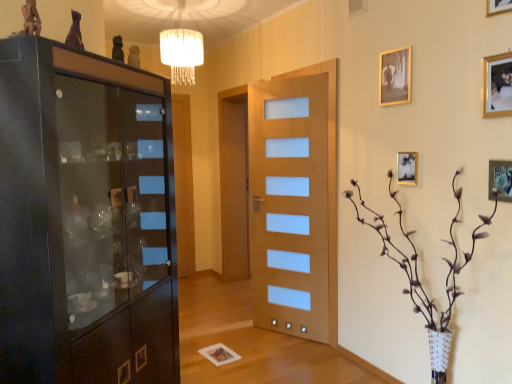
Question: Considering the relative sizes of metallic gold picture frame at upper right, which appears as the fifth picture frame when viewed from the top, and gold metallic picture frame at upper right, which appears as the 4th picture frame when viewed from the top, in the image provided, is metallic gold picture frame at upper right, which appears as the fifth picture frame when viewed from the top, shorter than gold metallic picture frame at upper right, which appears as the 4th picture frame when viewed from the top,?

Choices:
 (A) no
 (B) yes

Answer: (A)

Question: Can you confirm if metallic gold picture frame at upper right, which appears as the fifth picture frame when viewed from the top, is smaller than gold metallic picture frame at upper right, which appears as the 4th picture frame when viewed from the top?

Choices:
 (A) yes
 (B) no

Answer: (B)

Question: Is metallic gold picture frame at upper right, which appears as the fifth picture frame when viewed from the top, facing away from gold metallic picture frame at upper right, the 2th picture frame from the bottom?

Choices:
 (A) yes
 (B) no

Answer: (B)

Question: Is metallic gold picture frame at upper right, which appears as the fifth picture frame when viewed from the top, oriented towards gold metallic picture frame at upper right, which appears as the 4th picture frame when viewed from the top?

Choices:
 (A) no
 (B) yes

Answer: (A)

Question: Is metallic gold picture frame at upper right, which ranks as the first picture frame in bottom-to-top order, in front of gold metallic picture frame at upper right, which appears as the 4th picture frame when viewed from the top?

Choices:
 (A) yes
 (B) no

Answer: (A)

Question: Can you confirm if metallic gold picture frame at upper right, which ranks as the first picture frame in bottom-to-top order, is taller than gold metallic picture frame at upper right, the 2th picture frame from the bottom?

Choices:
 (A) no
 (B) yes

Answer: (B)

Question: From the image's perspective, is matte gold picture frame at upper right, which is counted as the second picture frame, starting from the top, above gold metallic picture frame at upper right, which is counted as the first picture frame, starting from the top?

Choices:
 (A) no
 (B) yes

Answer: (A)

Question: Can you confirm if matte gold picture frame at upper right, which is counted as the second picture frame, starting from the top, is positioned to the left of gold metallic picture frame at upper right, the 5th picture frame in the bottom-to-top sequence?

Choices:
 (A) yes
 (B) no

Answer: (A)

Question: Could you tell me if matte gold picture frame at upper right, which is counted as the second picture frame, starting from the top, is facing gold metallic picture frame at upper right, the 5th picture frame in the bottom-to-top sequence?

Choices:
 (A) yes
 (B) no

Answer: (B)

Question: Does matte gold picture frame at upper right, which is counted as the second picture frame, starting from the top, come behind gold metallic picture frame at upper right, the 5th picture frame in the bottom-to-top sequence?

Choices:
 (A) yes
 (B) no

Answer: (A)

Question: Is matte gold picture frame at upper right, which appears as the 4th picture frame when ordered from the bottom, positioned with its back to gold metallic picture frame at upper right, the 5th picture frame in the bottom-to-top sequence?

Choices:
 (A) no
 (B) yes

Answer: (A)

Question: From a real-world perspective, is matte gold picture frame at upper right, which is counted as the second picture frame, starting from the top, physically above gold metallic picture frame at upper right, the 5th picture frame in the bottom-to-top sequence?

Choices:
 (A) no
 (B) yes

Answer: (A)

Question: Could matte gold picture frame at upper right, which appears as the 4th picture frame when ordered from the bottom, be considered to be inside matte black cabinet at left?

Choices:
 (A) yes
 (B) no

Answer: (B)